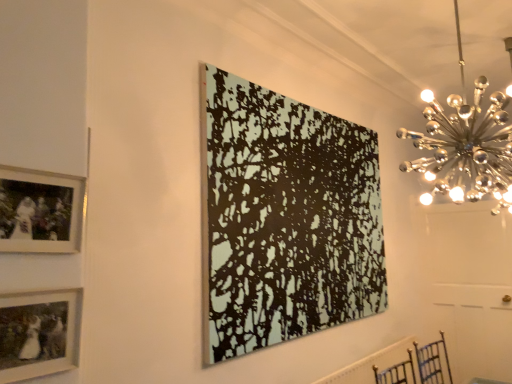
Question: From the image's perspective, is matte black picture frame at lower left, positioned as the 2th picture frame in left-to-right order, under white textured radiator at lower right?

Choices:
 (A) yes
 (B) no

Answer: (B)

Question: Is matte black picture frame at lower left, the third picture frame in the back-to-front sequence, next to white textured radiator at lower right?

Choices:
 (A) yes
 (B) no

Answer: (B)

Question: Does matte black picture frame at lower left, the third picture frame in the back-to-front sequence, have a larger size compared to white textured radiator at lower right?

Choices:
 (A) no
 (B) yes

Answer: (A)

Question: Does matte black picture frame at lower left, positioned as the 2th picture frame in left-to-right order, come in front of white textured radiator at lower right?

Choices:
 (A) no
 (B) yes

Answer: (B)

Question: Does matte black picture frame at lower left, arranged as the first picture frame when viewed from the front, contain white textured radiator at lower right?

Choices:
 (A) yes
 (B) no

Answer: (B)

Question: Relative to polished chrome chandelier at upper right, is black textured canvas at center, the 1th picture frame positioned from the back, in front or behind?

Choices:
 (A) front
 (B) behind

Answer: (B)

Question: Is point (216, 114) closer or farther from the camera than point (448, 142)?

Choices:
 (A) closer
 (B) farther

Answer: (B)

Question: Based on their sizes in the image, would you say black textured canvas at center, the 3th picture frame viewed from the left, is bigger or smaller than polished chrome chandelier at upper right?

Choices:
 (A) small
 (B) big

Answer: (B)

Question: From a real-world perspective, is black textured canvas at center, which appears as the 1th picture frame when viewed from the right, positioned above or below polished chrome chandelier at upper right?

Choices:
 (A) below
 (B) above

Answer: (A)

Question: Considering the positions of point (297, 216) and point (81, 183), is point (297, 216) closer or farther from the camera than point (81, 183)?

Choices:
 (A) farther
 (B) closer

Answer: (A)

Question: Considering the positions of black textured canvas at center, the third picture frame when ordered from front to back, and matte silver picture frame at upper left, the second picture frame viewed from the front, in the image, is black textured canvas at center, the third picture frame when ordered from front to back, taller or shorter than matte silver picture frame at upper left, the second picture frame viewed from the front,?

Choices:
 (A) tall
 (B) short

Answer: (A)

Question: Considering the relative positions of black textured canvas at center, which appears as the 1th picture frame when viewed from the right, and matte silver picture frame at upper left, the 3th picture frame viewed from the right, in the image provided, is black textured canvas at center, which appears as the 1th picture frame when viewed from the right, to the left or to the right of matte silver picture frame at upper left, the 3th picture frame viewed from the right,?

Choices:
 (A) left
 (B) right

Answer: (B)

Question: Considering the positions of black textured canvas at center, the third picture frame when ordered from front to back, and matte silver picture frame at upper left, which is counted as the first picture frame, starting from the left, in the image, is black textured canvas at center, the third picture frame when ordered from front to back, bigger or smaller than matte silver picture frame at upper left, which is counted as the first picture frame, starting from the left,?

Choices:
 (A) small
 (B) big

Answer: (B)

Question: Considering the positions of white textured radiator at lower right and matte silver picture frame at upper left, the 3th picture frame viewed from the right, in the image, is white textured radiator at lower right wider or thinner than matte silver picture frame at upper left, the 3th picture frame viewed from the right,?

Choices:
 (A) thin
 (B) wide

Answer: (B)

Question: Is white textured radiator at lower right to the left or to the right of matte silver picture frame at upper left, which is counted as the first picture frame, starting from the left, in the image?

Choices:
 (A) left
 (B) right

Answer: (B)